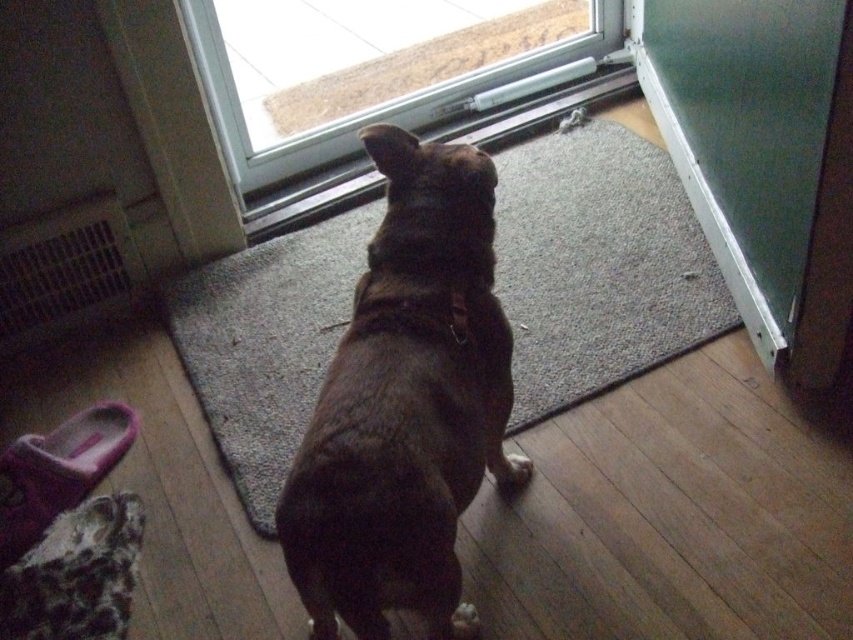
Between point (340, 4) and point (778, 99), which one is positioned behind?

Positioned behind is point (340, 4).

Which of these two, transparent glass door at upper center or green glass screen door at upper right, stands shorter?

transparent glass door at upper center

This screenshot has height=640, width=853. What do you see at coordinates (386, 83) in the screenshot?
I see `transparent glass door at upper center` at bounding box center [386, 83].

Where is `transparent glass door at upper center`? transparent glass door at upper center is located at coordinates (386, 83).

Can you confirm if brown fur dog at center is wider than transparent glass door at upper center?

No.

Between brown fur dog at center and transparent glass door at upper center, which one is positioned higher?

transparent glass door at upper center

Locate an element on the screen. The width and height of the screenshot is (853, 640). brown fur dog at center is located at coordinates (405, 404).

Is point (397, 464) positioned after point (717, 164)?

No, it is in front of (717, 164).

Can you confirm if brown fur dog at center is wider than green glass screen door at upper right?

Yes.

Is point (335, 560) closer to viewer compared to point (746, 4)?

That is True.

I want to click on brown fur dog at center, so click(x=405, y=404).